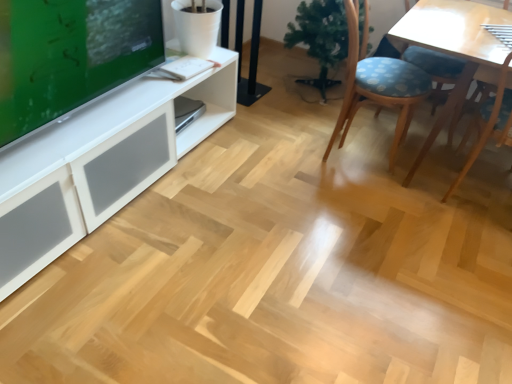
This screenshot has height=384, width=512. Identify the location of vacant space in front of green matte artificial plant at center. (305, 120).